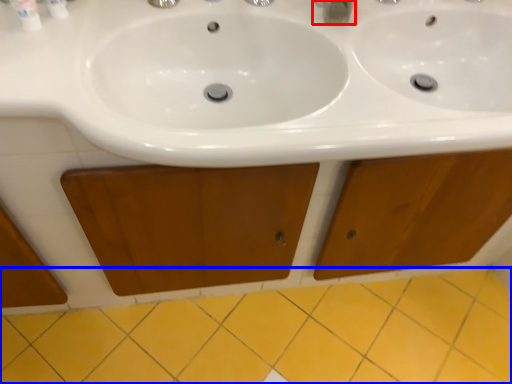
Question: Which point is closer to the camera, plumbing fixture (highlighted by a red box) or ceramic tile (highlighted by a blue box)?

Choices:
 (A) plumbing fixture
 (B) ceramic tile

Answer: (A)